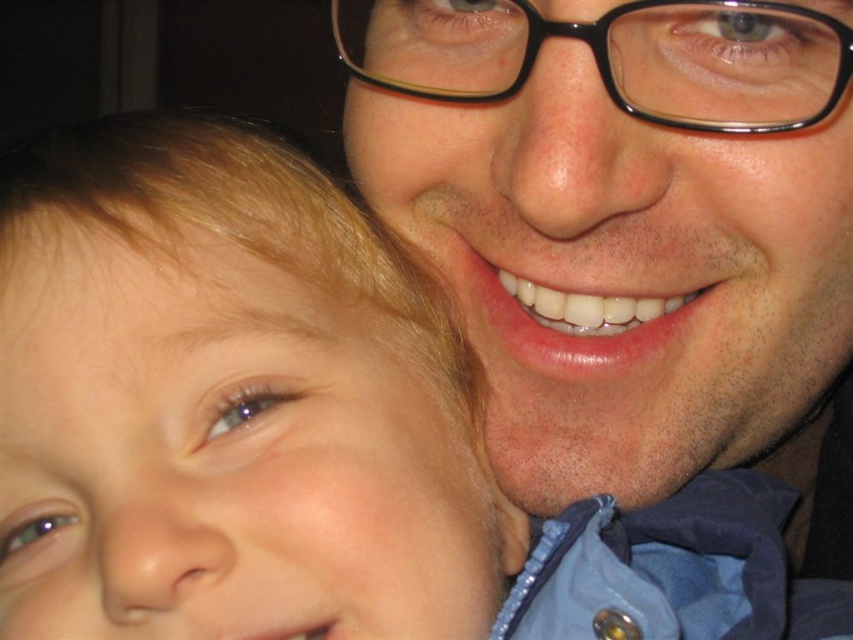
Question: Is the position of smooth skin face at upper right more distant than that of smooth blonde hair at left?

Choices:
 (A) yes
 (B) no

Answer: (A)

Question: Does smooth skin face at upper right appear under smooth blonde hair at left?

Choices:
 (A) yes
 (B) no

Answer: (A)

Question: Can you confirm if smooth skin face at upper right is positioned to the left of smooth blonde hair at left?

Choices:
 (A) no
 (B) yes

Answer: (A)

Question: Among these points, which one is farthest from the camera?

Choices:
 (A) (56, 182)
 (B) (769, 545)

Answer: (B)